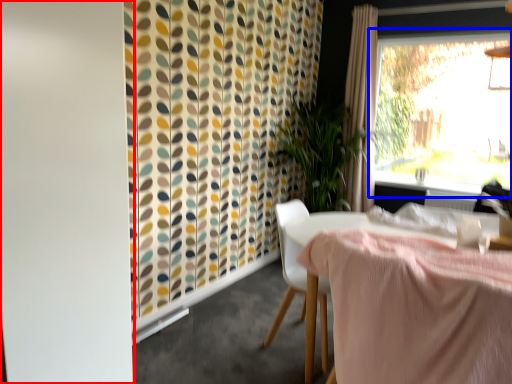
Question: Which point is further to the camera, screen door (highlighted by a red box) or window (highlighted by a blue box)?

Choices:
 (A) screen door
 (B) window

Answer: (B)